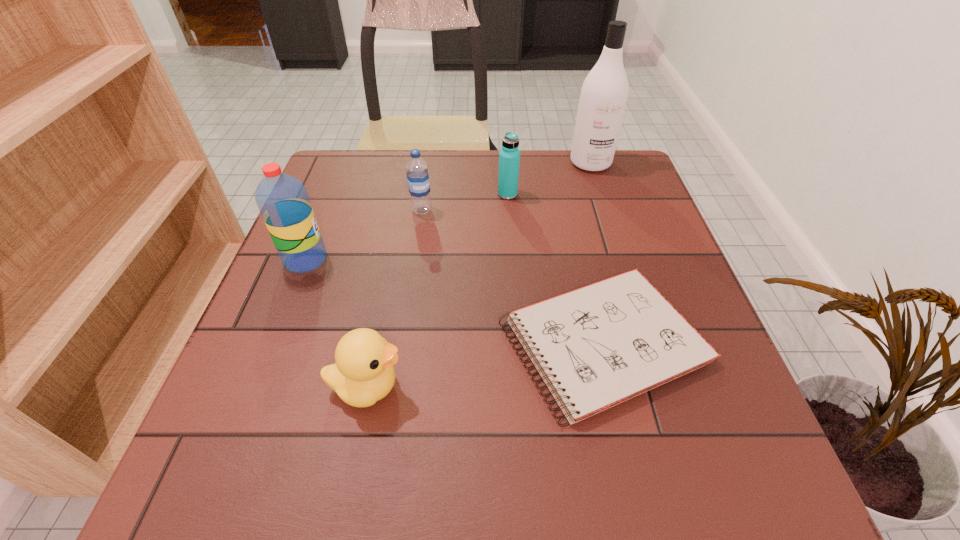
Locate an element on the screen. shampoo is located at coordinates (603, 98).

Find the location of a particular element. Image resolution: width=960 pixels, height=540 pixels. the tallest object is located at coordinates (603, 98).

At what (x,y) coordinates should I click in order to perform the action: click on the nearest water bottle. Please return your answer as a coordinate pair (x, y). The width and height of the screenshot is (960, 540). Looking at the image, I should click on (283, 201).

Where is `the leftmost water bottle`? the leftmost water bottle is located at coordinates (283, 201).

The image size is (960, 540). What are the coordinates of `the farthest water bottle` in the screenshot? It's located at (509, 156).

Where is `the rightmost water bottle`? the rightmost water bottle is located at coordinates (509, 156).

Identify the location of the second water bottle from right to left. (417, 171).

Where is `the fourth nearest object`? This screenshot has height=540, width=960. the fourth nearest object is located at coordinates (417, 171).

This screenshot has width=960, height=540. I want to click on duck, so click(363, 374).

Where is `the shortest object`? The height and width of the screenshot is (540, 960). the shortest object is located at coordinates (595, 347).